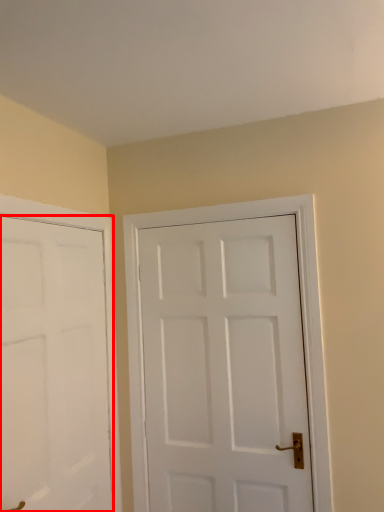
Question: Observing the image, what is the correct spatial positioning of door (annotated by the red box) in reference to door?

Choices:
 (A) left
 (B) right

Answer: (A)